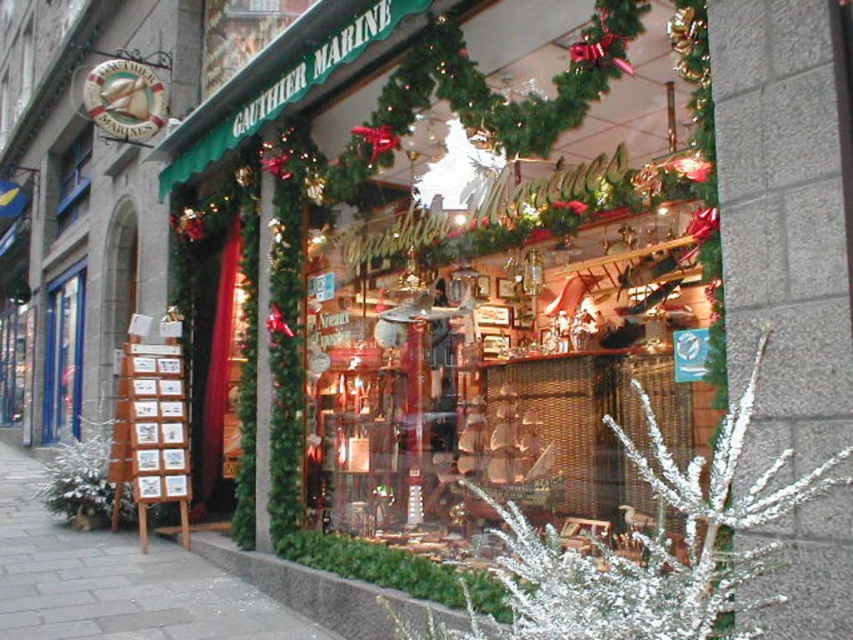
Does gray stone pavement at lower left appear on the right side of blue glass door at left?

Indeed, gray stone pavement at lower left is positioned on the right side of blue glass door at left.

Who is more distant from viewer, (61, 556) or (47, 403)?

The point (47, 403) is more distant.

At what (x,y) coordinates should I click in order to perform the action: click on gray stone pavement at lower left. Please return your answer as a coordinate pair (x, y). Image resolution: width=853 pixels, height=640 pixels. Looking at the image, I should click on (115, 580).